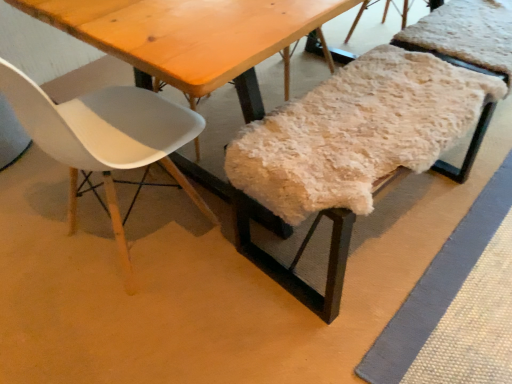
This screenshot has width=512, height=384. I want to click on white matte plastic chair at left, which ranks as the first chair in left-to-right order, so click(105, 140).

This screenshot has height=384, width=512. Describe the element at coordinates (105, 140) in the screenshot. I see `white matte plastic chair at left, which ranks as the first chair in left-to-right order` at that location.

Where is `fuzzy woolen bench at center, the 1th chair from the right`? fuzzy woolen bench at center, the 1th chair from the right is located at coordinates point(296,253).

The height and width of the screenshot is (384, 512). Describe the element at coordinates (296, 253) in the screenshot. I see `fuzzy woolen bench at center, the 1th chair from the right` at that location.

Locate an element on the screen. white matte plastic chair at left, positioned as the second chair in right-to-left order is located at coordinates (105, 140).

Which object is positioned more to the right, fuzzy woolen bench at center, marked as the 2th chair in a left-to-right arrangement, or white matte plastic chair at left, positioned as the second chair in right-to-left order?

From the viewer's perspective, fuzzy woolen bench at center, marked as the 2th chair in a left-to-right arrangement, appears more on the right side.

Is fuzzy woolen bench at center, marked as the 2th chair in a left-to-right arrangement, positioned in front of white matte plastic chair at left, positioned as the second chair in right-to-left order?

No, fuzzy woolen bench at center, marked as the 2th chair in a left-to-right arrangement, is further to the viewer.

Which point is more forward, (266, 259) or (158, 117)?

The point (158, 117) is in front.

From the image's perspective, which is below, fuzzy woolen bench at center, the 1th chair from the right, or white matte plastic chair at left, positioned as the second chair in right-to-left order?

fuzzy woolen bench at center, the 1th chair from the right.

From a real-world perspective, is fuzzy woolen bench at center, the 1th chair from the right, located higher than white matte plastic chair at left, which ranks as the first chair in left-to-right order?

Actually, fuzzy woolen bench at center, the 1th chair from the right, is physically below white matte plastic chair at left, which ranks as the first chair in left-to-right order, in the real world.

Is fuzzy woolen bench at center, marked as the 2th chair in a left-to-right arrangement, wider than white matte plastic chair at left, positioned as the second chair in right-to-left order?

Incorrect, the width of fuzzy woolen bench at center, marked as the 2th chair in a left-to-right arrangement, does not surpass that of white matte plastic chair at left, positioned as the second chair in right-to-left order.

Considering the sizes of objects fuzzy woolen bench at center, the 1th chair from the right, and white matte plastic chair at left, positioned as the second chair in right-to-left order, in the image provided, who is shorter, fuzzy woolen bench at center, the 1th chair from the right, or white matte plastic chair at left, positioned as the second chair in right-to-left order,?

fuzzy woolen bench at center, the 1th chair from the right, is shorter.

Is fuzzy woolen bench at center, the 1th chair from the right, bigger or smaller than white matte plastic chair at left, which ranks as the first chair in left-to-right order?

fuzzy woolen bench at center, the 1th chair from the right, is smaller than white matte plastic chair at left, which ranks as the first chair in left-to-right order.

Is fuzzy woolen bench at center, marked as the 2th chair in a left-to-right arrangement, positioned beyond the bounds of white matte plastic chair at left, which ranks as the first chair in left-to-right order?

Yes, fuzzy woolen bench at center, marked as the 2th chair in a left-to-right arrangement, is not within white matte plastic chair at left, which ranks as the first chair in left-to-right order.

Can you see fuzzy woolen bench at center, the 1th chair from the right, touching white matte plastic chair at left, positioned as the second chair in right-to-left order?

No.

Is fuzzy woolen bench at center, marked as the 2th chair in a left-to-right arrangement, positioned with its back to white matte plastic chair at left, positioned as the second chair in right-to-left order?

No, white matte plastic chair at left, positioned as the second chair in right-to-left order, is not at the back of fuzzy woolen bench at center, marked as the 2th chair in a left-to-right arrangement.

What's the angular difference between fuzzy woolen bench at center, the 1th chair from the right, and white matte plastic chair at left, which ranks as the first chair in left-to-right order,'s facing directions?

The angle between the facing direction of fuzzy woolen bench at center, the 1th chair from the right, and the facing direction of white matte plastic chair at left, which ranks as the first chair in left-to-right order, is 91.9 degrees.

How much distance is there between fuzzy woolen bench at center, marked as the 2th chair in a left-to-right arrangement, and white matte plastic chair at left, positioned as the second chair in right-to-left order?

fuzzy woolen bench at center, marked as the 2th chair in a left-to-right arrangement, is 19.09 inches away from white matte plastic chair at left, positioned as the second chair in right-to-left order.

Where is `chair located below the white matte plastic chair at left, positioned as the second chair in right-to-left order (from the image's perspective)`? The height and width of the screenshot is (384, 512). chair located below the white matte plastic chair at left, positioned as the second chair in right-to-left order (from the image's perspective) is located at coordinates (296, 253).

Considering the relative positions of white matte plastic chair at left, positioned as the second chair in right-to-left order, and fuzzy woolen bench at center, the 1th chair from the right, in the image provided, is white matte plastic chair at left, positioned as the second chair in right-to-left order, to the left or to the right of fuzzy woolen bench at center, the 1th chair from the right,?

In the image, white matte plastic chair at left, positioned as the second chair in right-to-left order, appears on the left side of fuzzy woolen bench at center, the 1th chair from the right.

Does white matte plastic chair at left, which ranks as the first chair in left-to-right order, lie behind fuzzy woolen bench at center, marked as the 2th chair in a left-to-right arrangement?

No, the depth of white matte plastic chair at left, which ranks as the first chair in left-to-right order, is less than that of fuzzy woolen bench at center, marked as the 2th chair in a left-to-right arrangement.

Considering the points (119, 103) and (304, 290), which point is behind, point (119, 103) or point (304, 290)?

The point (119, 103) is farther from the camera.

From the image's perspective, does white matte plastic chair at left, which ranks as the first chair in left-to-right order, appear higher than fuzzy woolen bench at center, marked as the 2th chair in a left-to-right arrangement?

Yes, from the image's perspective, white matte plastic chair at left, which ranks as the first chair in left-to-right order, is over fuzzy woolen bench at center, marked as the 2th chair in a left-to-right arrangement.

From a real-world perspective, which object stands above the other?

From a 3D spatial view, white matte plastic chair at left, which ranks as the first chair in left-to-right order, is above.

Between white matte plastic chair at left, which ranks as the first chair in left-to-right order, and fuzzy woolen bench at center, the 1th chair from the right, which one has larger width?

Wider between the two is white matte plastic chair at left, which ranks as the first chair in left-to-right order.

From their relative heights in the image, would you say white matte plastic chair at left, positioned as the second chair in right-to-left order, is taller or shorter than fuzzy woolen bench at center, the 1th chair from the right?

Considering their sizes, white matte plastic chair at left, positioned as the second chair in right-to-left order, has more height than fuzzy woolen bench at center, the 1th chair from the right.

Is white matte plastic chair at left, positioned as the second chair in right-to-left order, bigger or smaller than fuzzy woolen bench at center, marked as the 2th chair in a left-to-right arrangement?

A: Considering their sizes, white matte plastic chair at left, positioned as the second chair in right-to-left order, takes up more space than fuzzy woolen bench at center, marked as the 2th chair in a left-to-right arrangement.

Would you say white matte plastic chair at left, positioned as the second chair in right-to-left order, is inside or outside fuzzy woolen bench at center, marked as the 2th chair in a left-to-right arrangement?

white matte plastic chair at left, positioned as the second chair in right-to-left order, cannot be found inside fuzzy woolen bench at center, marked as the 2th chair in a left-to-right arrangement.

Is white matte plastic chair at left, which ranks as the first chair in left-to-right order, far away from fuzzy woolen bench at center, the 1th chair from the right?

That's not correct — white matte plastic chair at left, which ranks as the first chair in left-to-right order, is a little close to fuzzy woolen bench at center, the 1th chair from the right.

Is white matte plastic chair at left, positioned as the second chair in right-to-left order, facing towards fuzzy woolen bench at center, the 1th chair from the right?

No, white matte plastic chair at left, positioned as the second chair in right-to-left order, does not turn towards fuzzy woolen bench at center, the 1th chair from the right.

What's the angular difference between white matte plastic chair at left, positioned as the second chair in right-to-left order, and fuzzy woolen bench at center, marked as the 2th chair in a left-to-right arrangement,'s facing directions?

91.9 degrees separate the facing orientations of white matte plastic chair at left, positioned as the second chair in right-to-left order, and fuzzy woolen bench at center, marked as the 2th chair in a left-to-right arrangement.

Where is `chair in front of the fuzzy woolen bench at center, the 1th chair from the right`? chair in front of the fuzzy woolen bench at center, the 1th chair from the right is located at coordinates (105, 140).

At what (x,y) coordinates should I click in order to perform the action: click on chair on the right of white matte plastic chair at left, positioned as the second chair in right-to-left order. Please return your answer as a coordinate pair (x, y). The height and width of the screenshot is (384, 512). Looking at the image, I should click on (296, 253).

At what (x,y) coordinates should I click in order to perform the action: click on chair that is under the white matte plastic chair at left, which ranks as the first chair in left-to-right order (from a real-world perspective). Please return your answer as a coordinate pair (x, y). The width and height of the screenshot is (512, 384). Looking at the image, I should click on (296, 253).